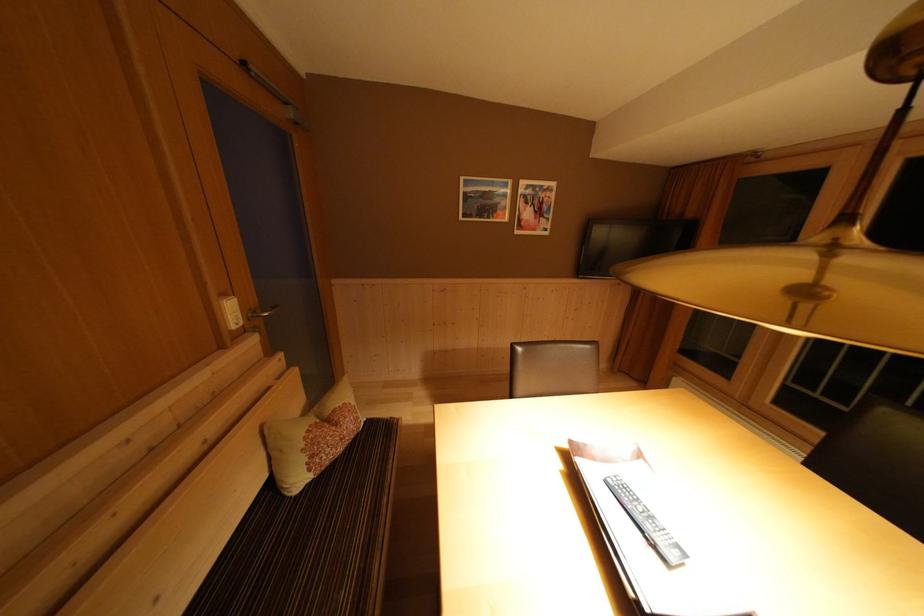
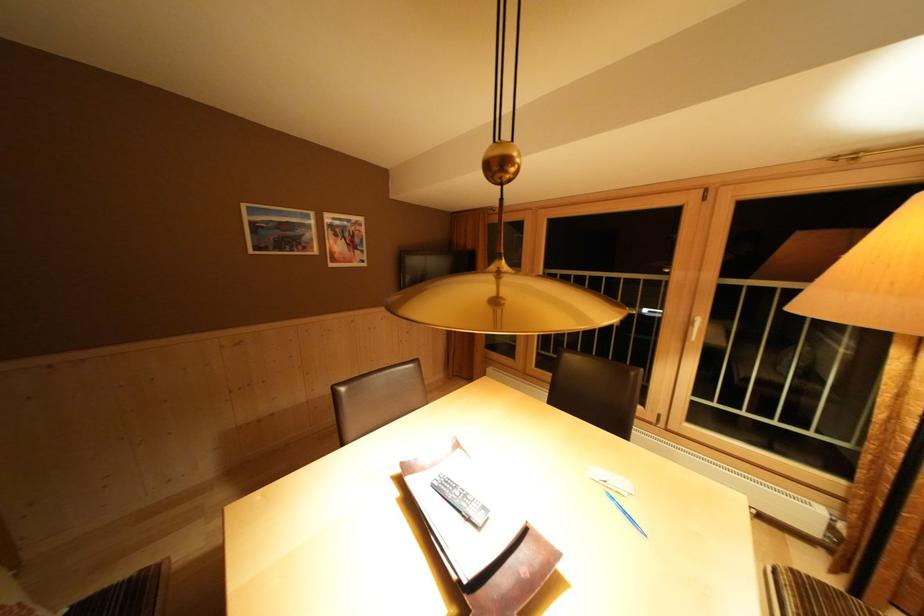
In the second image, find the point that corresponds to [617,485] in the first image.

(442, 488)